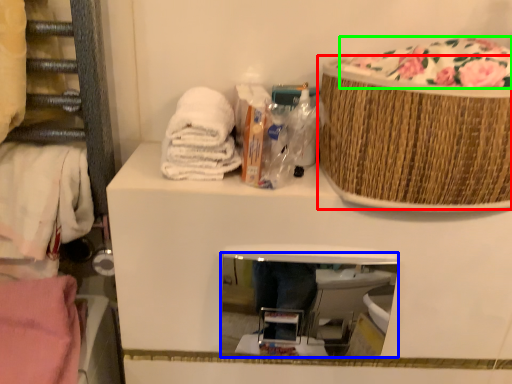
Question: Estimate the real-world distances between objects in this image. Which object is closer to basket (highlighted by a red box), mirror (highlighted by a blue box) or food (highlighted by a green box)?

Choices:
 (A) mirror
 (B) food

Answer: (B)